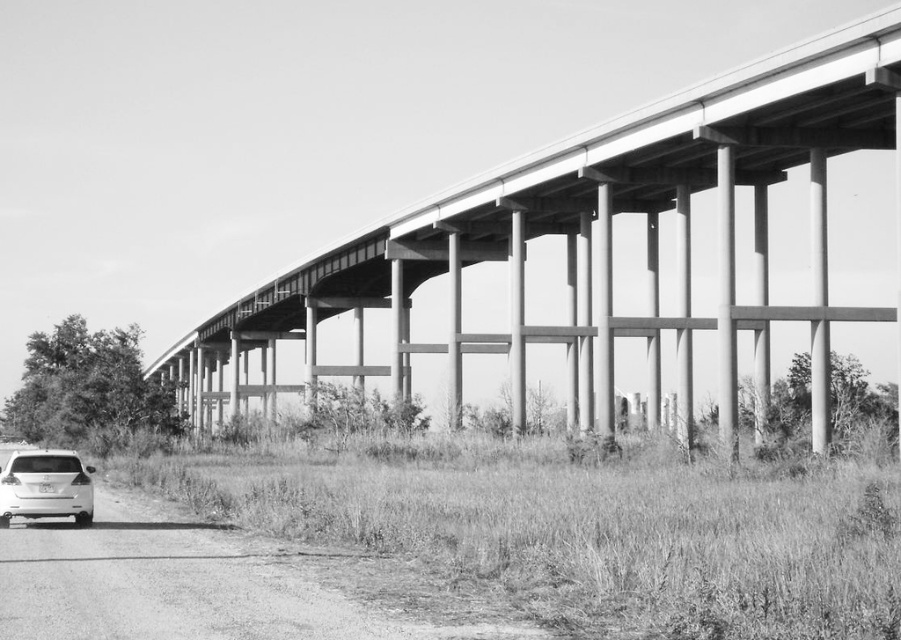
Question: Among these points, which one is farthest from the camera?

Choices:
 (A) (88, 499)
 (B) (181, 369)

Answer: (B)

Question: Which point is farther to the camera?

Choices:
 (A) white matte car at lower left
 (B) concrete bridge at center

Answer: (B)

Question: Does concrete bridge at center appear under white matte car at lower left?

Choices:
 (A) yes
 (B) no

Answer: (B)

Question: Which point is closer to the camera?

Choices:
 (A) concrete bridge at center
 (B) white matte car at lower left

Answer: (B)

Question: Is concrete bridge at center wider than white matte car at lower left?

Choices:
 (A) yes
 (B) no

Answer: (A)

Question: Observing the image, what is the correct spatial positioning of concrete bridge at center in reference to white matte car at lower left?

Choices:
 (A) left
 (B) right

Answer: (B)